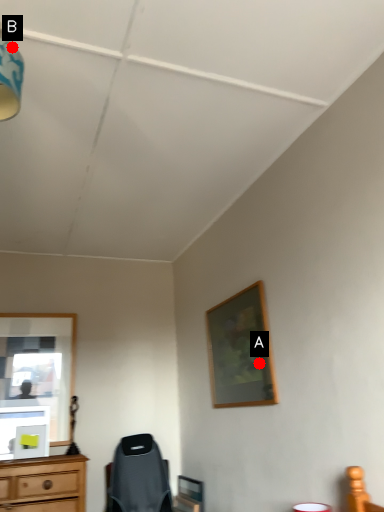
Question: Two points are circled on the image, labeled by A and B beside each circle. Which point appears closest to the camera in this image?

Choices:
 (A) A is closer
 (B) B is closer

Answer: (B)